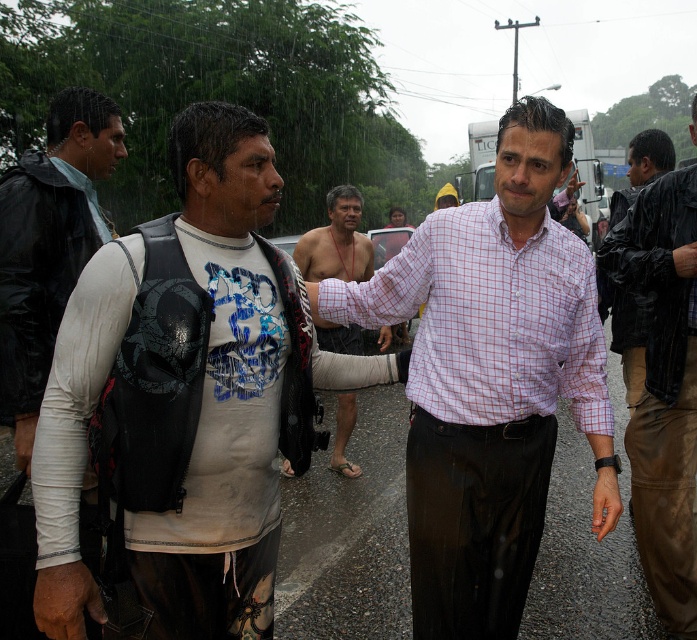
This screenshot has width=697, height=640. What do you see at coordinates (661, 388) in the screenshot?
I see `matte black jacket at center` at bounding box center [661, 388].

Can you confirm if matte black jacket at center is smaller than black matte jacket at right?

Yes, matte black jacket at center is smaller than black matte jacket at right.

Is point (659, 342) more distant than point (622, 301)?

No, (659, 342) is closer to viewer.

Identify the location of matte black jacket at center. Image resolution: width=697 pixels, height=640 pixels. (661, 388).

Who is lower down, plaid cotton shirt at center or black matte jacket at right?

plaid cotton shirt at center is below.

Which of these two, plaid cotton shirt at center or black matte jacket at right, stands taller?

With more height is black matte jacket at right.

Does point (420, 532) come in front of point (615, 336)?

That is True.

What are the coordinates of `plaid cotton shirt at center` in the screenshot? It's located at (490, 380).

Does white matte shirt at center appear on the left side of matte black jacket at center?

Indeed, white matte shirt at center is positioned on the left side of matte black jacket at center.

Can you confirm if white matte shirt at center is taller than matte black jacket at center?

Incorrect, white matte shirt at center's height is not larger of matte black jacket at center's.

Which is in front, point (250, 349) or point (631, 413)?

Positioned in front is point (250, 349).

You are a GUI agent. You are given a task and a screenshot of the screen. Output one action in this format:
    pyautogui.click(x=<x>, y=<y>)
    Task: Click on the white matte shirt at center
    This screenshot has height=640, width=697.
    Given the screenshot: What is the action you would take?
    pyautogui.click(x=231, y=388)